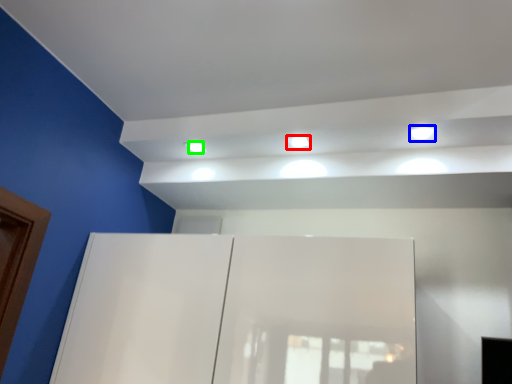
Question: Estimate the real-world distances between objects in this image. Which object is farther from light (highlighted by a red box), light (highlighted by a blue box) or dot (highlighted by a green box)?

Choices:
 (A) light
 (B) dot

Answer: (A)